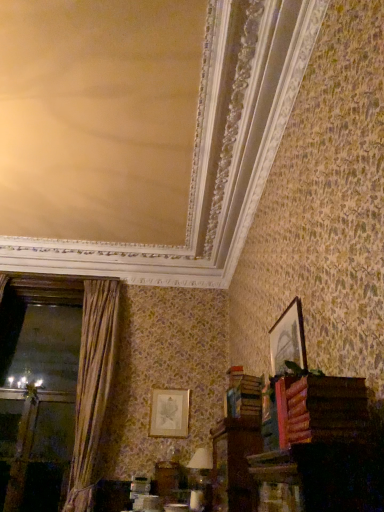
This screenshot has height=512, width=384. Describe the element at coordinates (92, 385) in the screenshot. I see `gold fabric curtain at left` at that location.

I want to click on wooden picture frame at upper right, the 2th picture frame from the back, so click(x=288, y=339).

What do you see at coordinates (288, 339) in the screenshot?
I see `wooden picture frame at upper right, arranged as the second picture frame when viewed from the left` at bounding box center [288, 339].

Describe the element at coordinates (200, 465) in the screenshot. I see `white paper at lower center` at that location.

Locate an element on the screen. The image size is (384, 512). matte silver picture frame at center, which ranks as the 2th picture frame in right-to-left order is located at coordinates click(169, 413).

Which object is further away from the camera taking this photo, white paper at lower center or wooden book at lower right, which is the second book in top-to-bottom order?

white paper at lower center is further away from the camera.

Considering the sizes of objects white paper at lower center and wooden book at lower right, which ranks as the 1th book in bottom-to-top order, in the image provided, who is bigger, white paper at lower center or wooden book at lower right, which ranks as the 1th book in bottom-to-top order,?

white paper at lower center is bigger.

Can you tell me how much white paper at lower center and wooden book at lower right, which is the second book in top-to-bottom order, differ in facing direction?

84.8 degrees.

From the image's perspective, is white paper at lower center under wooden book at lower right, which is the second book in top-to-bottom order?

Yes, from the image's perspective, white paper at lower center is beneath wooden book at lower right, which is the second book in top-to-bottom order.

Based on the photo, between gold fabric curtain at left and matte silver picture frame at center, the first picture frame positioned from the back, which one is positioned in front?

gold fabric curtain at left.

Does point (88, 319) come closer to viewer compared to point (167, 406)?

No, it is not.

Is gold fabric curtain at left far away from matte silver picture frame at center, which is the second picture frame in top-to-bottom order?

gold fabric curtain at left is near matte silver picture frame at center, which is the second picture frame in top-to-bottom order, not far away.

Is wooden picture frame at upper right, the 2th picture frame from the back, inside the boundaries of gold fabric curtain at left, or outside?

wooden picture frame at upper right, the 2th picture frame from the back, cannot be found inside gold fabric curtain at left.

Which object is positioned more to the right, wooden picture frame at upper right, marked as the first picture frame in a right-to-left arrangement, or gold fabric curtain at left?

Positioned to the right is wooden picture frame at upper right, marked as the first picture frame in a right-to-left arrangement.

Considering the points (270, 361) and (91, 477), which point is in front, point (270, 361) or point (91, 477)?

Positioned in front is point (270, 361).

In the scene shown: Does wooden picture frame at upper right, marked as the first picture frame in a right-to-left arrangement, come behind gold fabric curtain at left?

No, it is not.

Which is correct: wooden book at lower right, which is the 1th book from back to front, is inside wooden picture frame at upper right, arranged as the second picture frame when ordered from the bottom, or outside of it?

The correct answer is: outside.

Considering the relative sizes of wooden book at lower right, which is the 1th book from back to front, and wooden picture frame at upper right, arranged as the second picture frame when viewed from the left, in the image provided, is wooden book at lower right, which is the 1th book from back to front, shorter than wooden picture frame at upper right, arranged as the second picture frame when viewed from the left,?

Indeed, wooden book at lower right, which is the 1th book from back to front, has a lesser height compared to wooden picture frame at upper right, arranged as the second picture frame when viewed from the left.

Does point (255, 394) lie in front of point (279, 362)?

Yes, it is.

Identify the location of curtain lying on the left of wooden book at lower right, the second book when ordered from bottom to top. (92, 385).

Based on the photo, from a real-world perspective, which object stands above the other?

gold fabric curtain at left is physically above.

Is gold fabric curtain at left placed right next to wooden book at lower right, which is the first book from top to bottom?

No, gold fabric curtain at left is not in contact with wooden book at lower right, which is the first book from top to bottom.

Is matte silver picture frame at center, marked as the first picture frame in a bottom-to-top arrangement, at the left side of wooden book at lower right, the 2th book from the front?

Yes.

Does matte silver picture frame at center, which ranks as the 2th picture frame in right-to-left order, have a larger size compared to wooden book at lower right, which is the 1th book from back to front?

Actually, matte silver picture frame at center, which ranks as the 2th picture frame in right-to-left order, might be smaller than wooden book at lower right, which is the 1th book from back to front.

Is wooden book at lower right, which ranks as the 1th book in bottom-to-top order, located within matte silver picture frame at center, which ranks as the 1th picture frame in left-to-right order?

No, wooden book at lower right, which ranks as the 1th book in bottom-to-top order, is not inside matte silver picture frame at center, which ranks as the 1th picture frame in left-to-right order.

Who is taller, matte silver picture frame at center, which ranks as the 2th picture frame in right-to-left order, or wooden book at lower right, the 2th book from the front?

matte silver picture frame at center, which ranks as the 2th picture frame in right-to-left order, is taller.

Is gold fabric curtain at left completely or partially inside matte silver picture frame at center, which is the second picture frame in top-to-bottom order?

No, gold fabric curtain at left is not surrounded by matte silver picture frame at center, which is the second picture frame in top-to-bottom order.

Is matte silver picture frame at center, which is the second picture frame in top-to-bottom order, smaller than gold fabric curtain at left?

Indeed, matte silver picture frame at center, which is the second picture frame in top-to-bottom order, has a smaller size compared to gold fabric curtain at left.

How many degrees apart are the facing directions of matte silver picture frame at center, marked as the first picture frame in a bottom-to-top arrangement, and gold fabric curtain at left?

The angular difference between matte silver picture frame at center, marked as the first picture frame in a bottom-to-top arrangement, and gold fabric curtain at left is 4.94 degrees.

The image size is (384, 512). Identify the location of table lamp that is under the wooden book at lower right, the 2th book from the front (from a real-world perspective). (200, 465).

Where is `curtain above the matte silver picture frame at center, which is the second picture frame in top-to-bottom order (from the image's perspective)`? The image size is (384, 512). curtain above the matte silver picture frame at center, which is the second picture frame in top-to-bottom order (from the image's perspective) is located at coordinates (92, 385).

Considering their positions, is wooden book at lower right, which is the second book in top-to-bottom order, positioned further to wooden book at lower right, which ranks as the 1th book in front-to-back order, than matte silver picture frame at center, which is the second picture frame in top-to-bottom order?

The object further to wooden book at lower right, which ranks as the 1th book in front-to-back order, is matte silver picture frame at center, which is the second picture frame in top-to-bottom order.

Looking at the image, which one is located closer to wooden book at lower right, the second book when ordered from back to front, gold fabric curtain at left or wooden picture frame at upper right, arranged as the second picture frame when ordered from the bottom?

Based on the image, wooden picture frame at upper right, arranged as the second picture frame when ordered from the bottom, appears to be nearer to wooden book at lower right, the second book when ordered from back to front.

Considering their positions, is wooden picture frame at upper right, arranged as the second picture frame when viewed from the left, positioned further to wooden book at lower right, the second book when ordered from back to front, than matte silver picture frame at center, the first picture frame positioned from the back?

matte silver picture frame at center, the first picture frame positioned from the back, lies further to wooden book at lower right, the second book when ordered from back to front, than the other object.

When comparing their distances from wooden book at lower right, the 2th book from the front, does matte silver picture frame at center, which ranks as the 1th picture frame in left-to-right order, or wooden book at lower right, the second book when ordered from bottom to top, seem closer?

wooden book at lower right, the second book when ordered from bottom to top, lies closer to wooden book at lower right, the 2th book from the front, than the other object.

Which object lies nearer to the anchor point white paper at lower center, wooden book at lower right, the second book when ordered from back to front, or matte silver picture frame at center, the 2th picture frame positioned from the front?

matte silver picture frame at center, the 2th picture frame positioned from the front, is positioned closer to the anchor white paper at lower center.

Considering their positions, is matte silver picture frame at center, which ranks as the 1th picture frame in left-to-right order, positioned closer to wooden book at lower right, which ranks as the 1th book in bottom-to-top order, than white paper at lower center?

Among the two, white paper at lower center is located nearer to wooden book at lower right, which ranks as the 1th book in bottom-to-top order.

Based on their spatial positions, is wooden book at lower right, which ranks as the 1th book in bottom-to-top order, or white paper at lower center closer to gold fabric curtain at left?

white paper at lower center is positioned closer to the anchor gold fabric curtain at left.

Looking at the image, which one is located further to wooden picture frame at upper right, arranged as the first picture frame when viewed from the top, wooden book at lower right, the second book when ordered from bottom to top, or gold fabric curtain at left?

Based on the image, gold fabric curtain at left appears to be further to wooden picture frame at upper right, arranged as the first picture frame when viewed from the top.

I want to click on picture frame between wooden book at lower right, the second book when ordered from back to front, and wooden book at lower right, which is the second book in top-to-bottom order, in the front-back direction, so click(288, 339).

Image resolution: width=384 pixels, height=512 pixels. I want to click on picture frame between wooden book at lower right, the second book when ordered from bottom to top, and white paper at lower center from front to back, so click(x=288, y=339).

At what (x,y) coordinates should I click in order to perform the action: click on book between wooden book at lower right, which is the first book from top to bottom, and matte silver picture frame at center, the first picture frame positioned from the back, in the front-back direction. Please return your answer as a coordinate pair (x, y). The image size is (384, 512). Looking at the image, I should click on (243, 394).

Where is `curtain between wooden picture frame at upper right, arranged as the second picture frame when viewed from the left, and matte silver picture frame at center, the first picture frame positioned from the back, along the z-axis`? This screenshot has width=384, height=512. curtain between wooden picture frame at upper right, arranged as the second picture frame when viewed from the left, and matte silver picture frame at center, the first picture frame positioned from the back, along the z-axis is located at coordinates (92, 385).